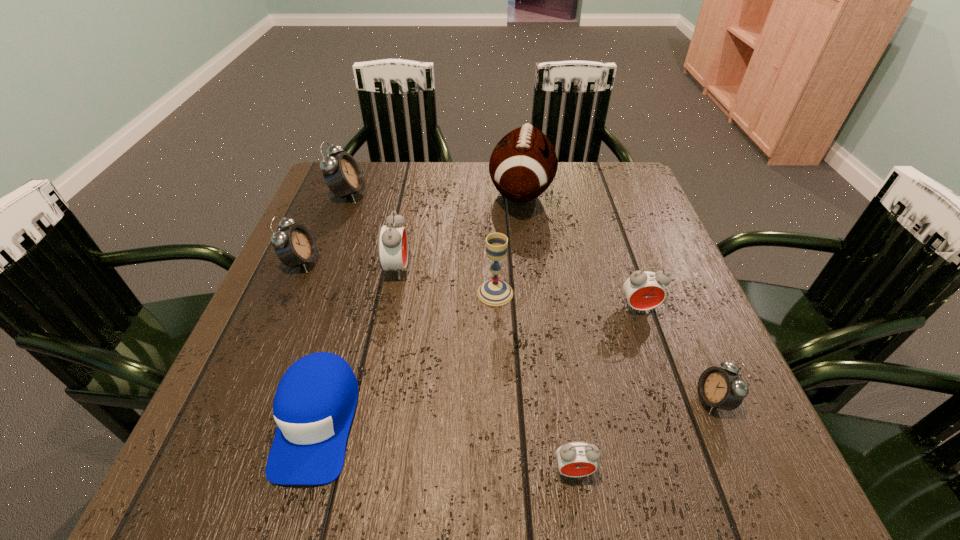
Locate an element on the screen. football (American) is located at coordinates (523, 164).

This screenshot has height=540, width=960. What are the coordinates of `the farthest alarm clock` in the screenshot? It's located at (342, 174).

Where is `the farthest white alarm clock`? The width and height of the screenshot is (960, 540). the farthest white alarm clock is located at coordinates (342, 174).

You are a GUI agent. You are given a task and a screenshot of the screen. Output one action in this format:
    pyautogui.click(x=<x>, y=<y>)
    Task: Click on the leftmost red alarm clock
    The image size is (960, 540).
    Given the screenshot: What is the action you would take?
    pyautogui.click(x=392, y=246)

Identify the location of the fourth alarm clock from right to left. (392, 246).

Image resolution: width=960 pixels, height=540 pixels. In order to click on chalice in this screenshot , I will do `click(495, 292)`.

I want to click on the second smallest white alarm clock, so click(x=295, y=245).

In order to click on the third nearest alarm clock in this screenshot , I will do `click(644, 290)`.

Identify the location of the second nearest red alarm clock. (644, 290).

Locate an element on the screen. the smallest white alarm clock is located at coordinates (720, 388).